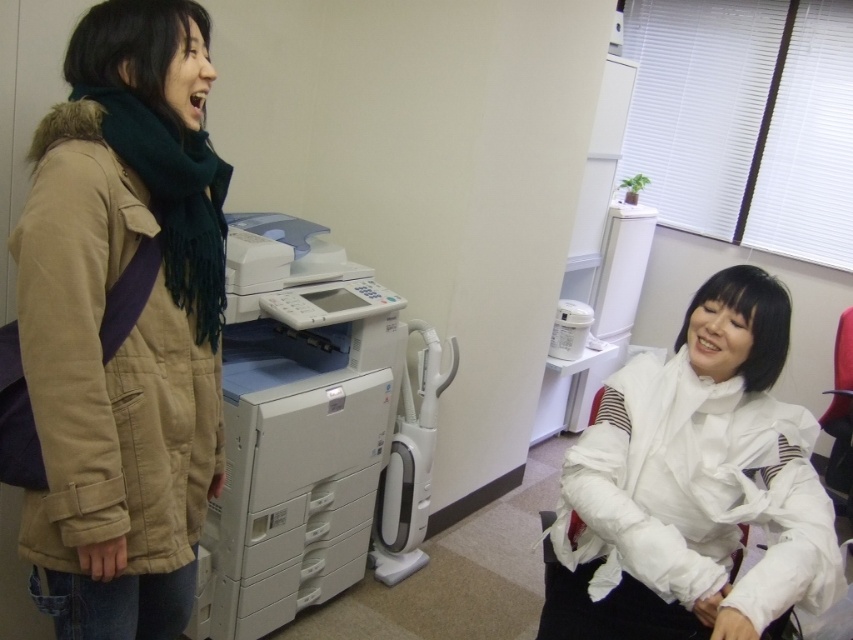
You are organizing the office and need to place a new item between the white fabric at center and the white matte printer at left. Which object should you place it closer to if you want it to be nearer to the viewer?

You should place the new item closer to the white fabric at center because it is already closer to the viewer than the white matte printer at left.

You are organizing the office and need to place a new item on the desk. The desk has limited space. You have a white fabric at center and a white matte printer at left. Which object is closer to the edge of the desk?

The white fabric at center is located below the white matte printer at left, so the white fabric at center is closer to the edge of the desk.

You are organizing items in an office and need to place the matte brown jacket at left and the white matte printer at left on a shelf. Which object should you place first if you want to arrange them from shortest to tallest?

The matte brown jacket at left should be placed first because it is shorter than the white matte printer at left.